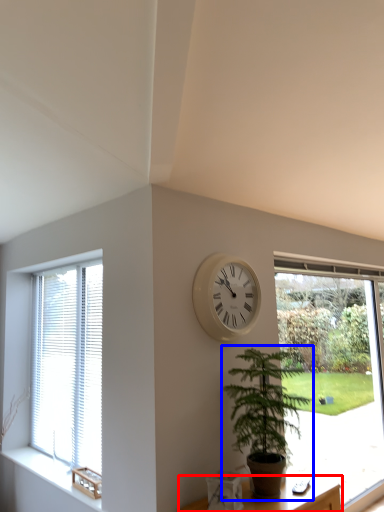
Question: Which of the following is the farthest to the observer, furniture (highlighted by a red box) or houseplant (highlighted by a blue box)?

Choices:
 (A) furniture
 (B) houseplant

Answer: (B)